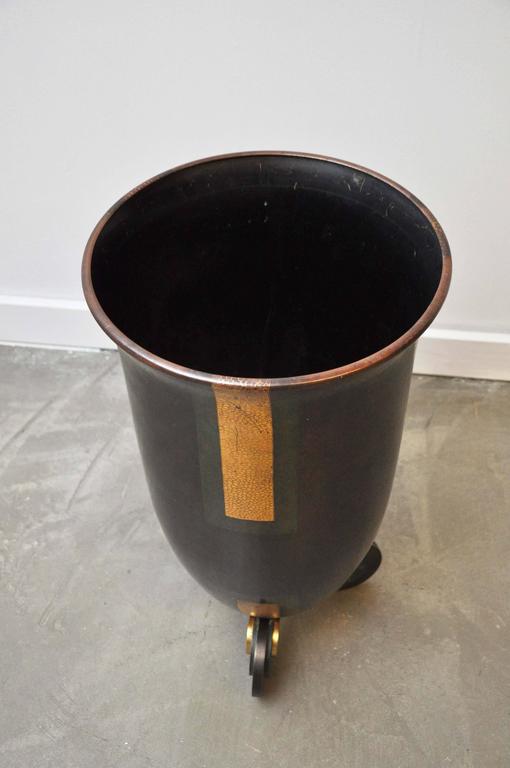
Find the location of `decor`. decor is located at coordinates (165, 455).